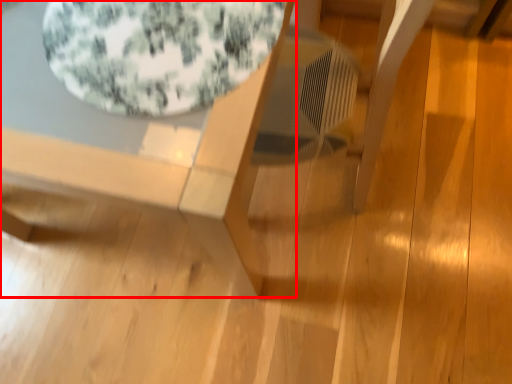
Question: Observing the image, what is the correct spatial positioning of table (annotated by the red box) in reference to bean bag chair?

Choices:
 (A) left
 (B) right

Answer: (A)